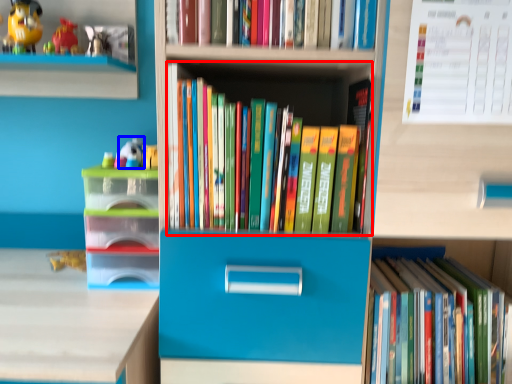
Question: Which of the following is the closest to the observer, book (highlighted by a red box) or toy (highlighted by a blue box)?

Choices:
 (A) book
 (B) toy

Answer: (A)